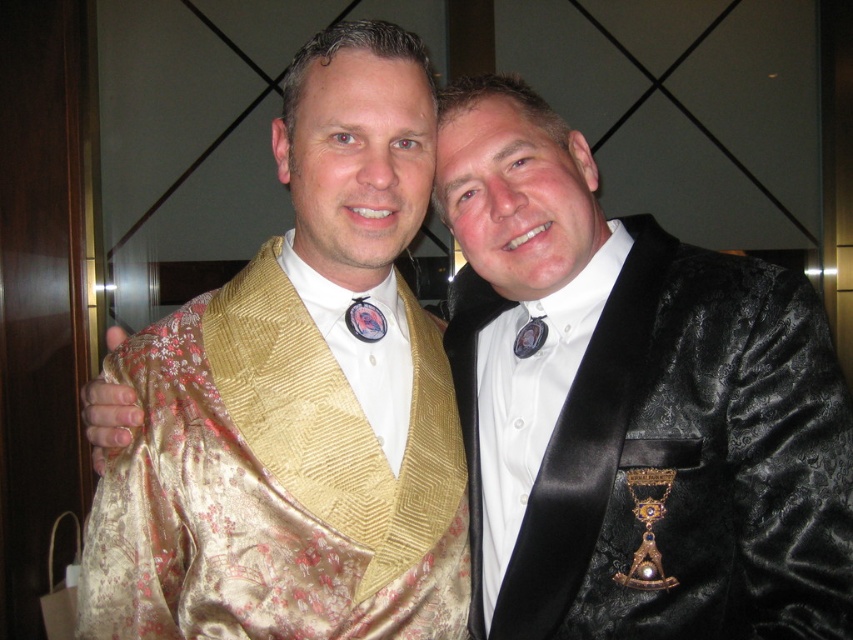
Who is taller, gold satin kimono at left or black velvet suit at right?

gold satin kimono at left

Which is above, gold satin kimono at left or black velvet suit at right?

gold satin kimono at left is above.

Who is more distant from viewer, (383, 200) or (723, 452)?

The point (383, 200) is more distant.

At what (x,y) coordinates should I click in order to perform the action: click on gold satin kimono at left. Please return your answer as a coordinate pair (x, y). Looking at the image, I should click on (299, 400).